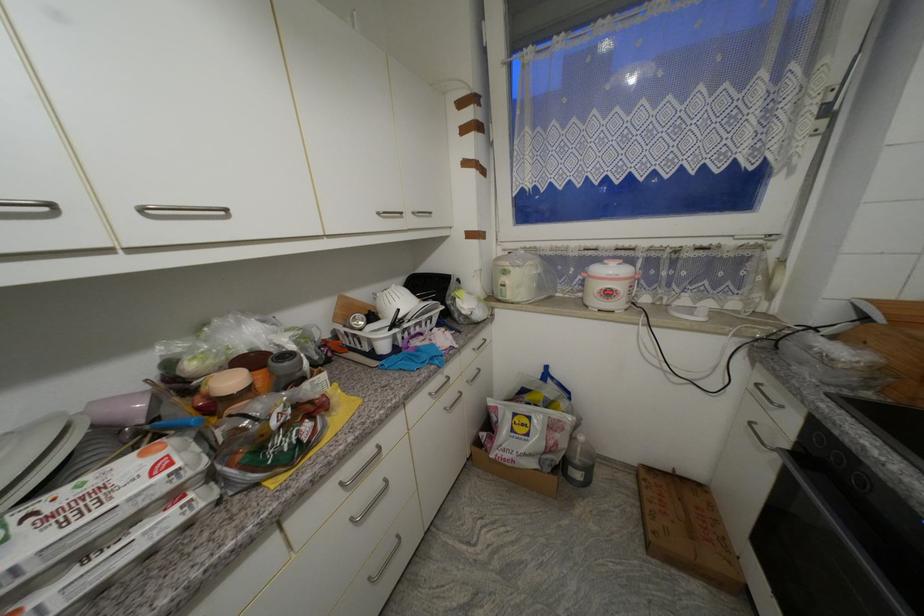
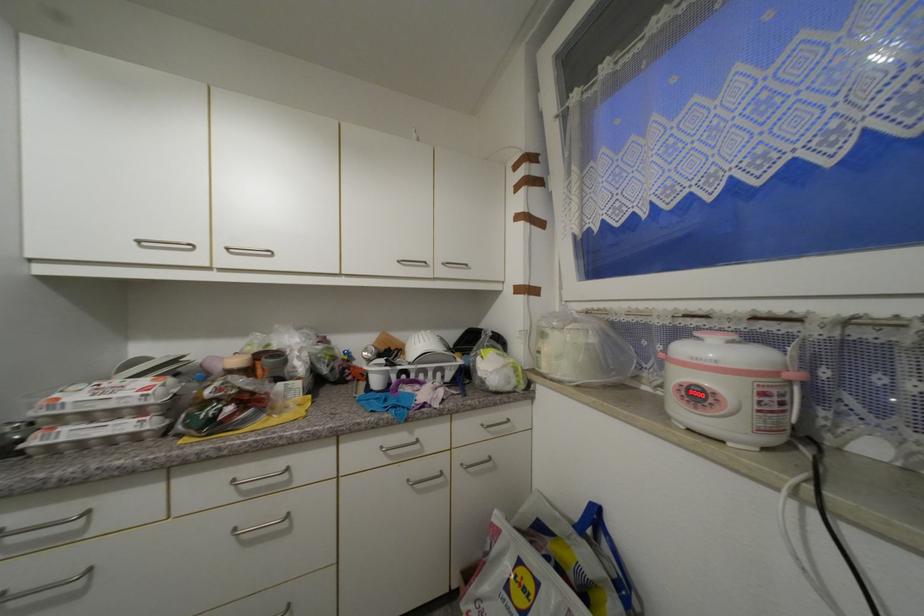
Question: The camera is either moving clockwise (left) or counter-clockwise (right) around the object. The first image is from the beginning of the video and the second image is from the end. Is the camera moving left or right when shooting the video?

Choices:
 (A) Left
 (B) Right

Answer: (B)